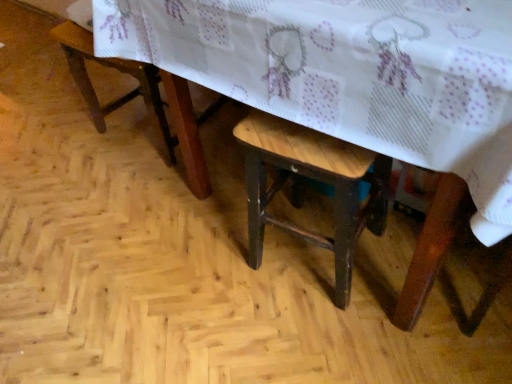
Question: Is wooden stool at center bigger than wooden stool at lower left?

Choices:
 (A) no
 (B) yes

Answer: (A)

Question: From the image's perspective, is wooden stool at center located beneath wooden stool at lower left?

Choices:
 (A) yes
 (B) no

Answer: (A)

Question: Would you say wooden stool at center contains wooden stool at lower left?

Choices:
 (A) no
 (B) yes

Answer: (A)

Question: Does wooden stool at center appear on the left side of wooden stool at lower left?

Choices:
 (A) no
 (B) yes

Answer: (A)

Question: Does wooden stool at center lie behind wooden stool at lower left?

Choices:
 (A) no
 (B) yes

Answer: (A)

Question: From a real-world perspective, is wooden stool at center over wooden stool at lower left?

Choices:
 (A) yes
 (B) no

Answer: (B)

Question: Can you confirm if wooden table at center is shorter than wooden stool at lower left?

Choices:
 (A) no
 (B) yes

Answer: (A)

Question: From the image's perspective, is wooden table at center on wooden stool at lower left?

Choices:
 (A) yes
 (B) no

Answer: (B)

Question: Is the position of wooden table at center more distant than that of wooden stool at lower left?

Choices:
 (A) yes
 (B) no

Answer: (B)

Question: Does wooden table at center have a greater height compared to wooden stool at lower left?

Choices:
 (A) no
 (B) yes

Answer: (B)

Question: Does wooden table at center turn towards wooden stool at lower left?

Choices:
 (A) yes
 (B) no

Answer: (B)

Question: Is the position of wooden table at center less distant than that of wooden stool at lower left?

Choices:
 (A) no
 (B) yes

Answer: (B)

Question: Is the position of wooden table at center less distant than that of wooden stool at center?

Choices:
 (A) yes
 (B) no

Answer: (A)